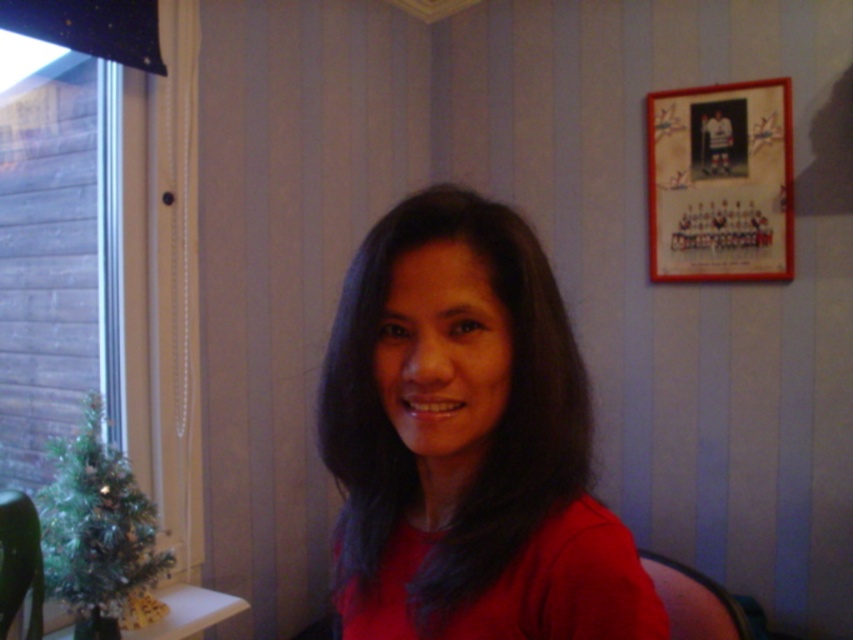
Is matte red shirt at center closer to camera compared to clear glass window at left?

Yes, matte red shirt at center is in front of clear glass window at left.

The height and width of the screenshot is (640, 853). In order to click on matte red shirt at center in this screenshot , I will do `click(467, 442)`.

Who is higher up, clear glass window at left or green glossy table at lower left?

clear glass window at left

Describe the element at coordinates (161, 280) in the screenshot. I see `clear glass window at left` at that location.

The image size is (853, 640). In order to click on clear glass window at left in this screenshot , I will do `click(161, 280)`.

Can you confirm if matte red shirt at center is wider than green glossy table at lower left?

Incorrect, matte red shirt at center's width does not surpass green glossy table at lower left's.

Is matte red shirt at center shorter than green glossy table at lower left?

Incorrect, matte red shirt at center's height does not fall short of green glossy table at lower left's.

Does point (439, 292) lie in front of point (68, 628)?

Yes, point (439, 292) is closer to viewer.

At what (x,y) coordinates should I click in order to perform the action: click on matte red shirt at center. Please return your answer as a coordinate pair (x, y). The height and width of the screenshot is (640, 853). Looking at the image, I should click on point(467,442).